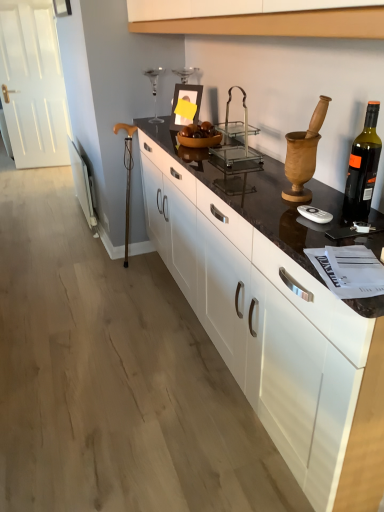
Where is `free space above black marble countertop at center (from a real-world perspective)`? free space above black marble countertop at center (from a real-world perspective) is located at coordinates (270, 182).